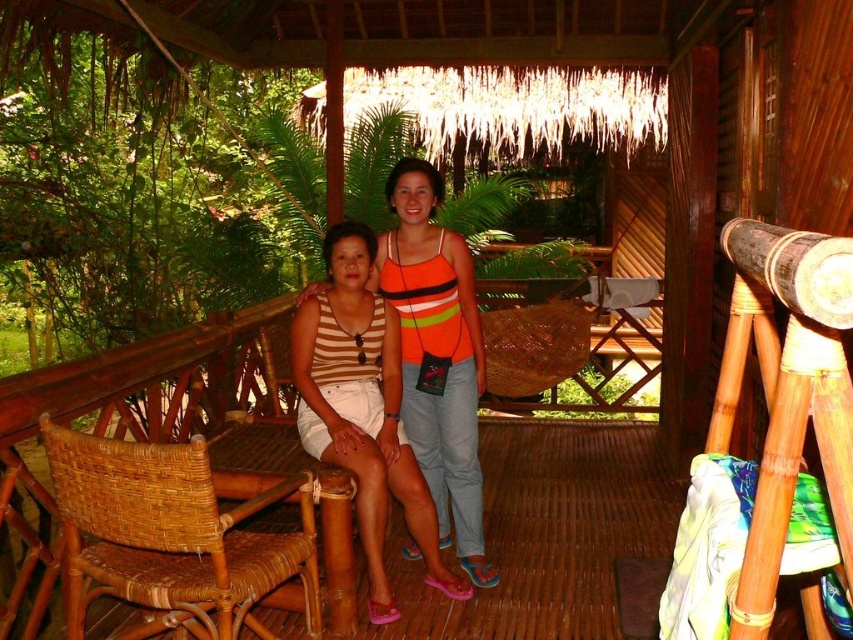
Locate an element on the screen. The height and width of the screenshot is (640, 853). woven rattan chair at lower left is located at coordinates (172, 536).

Between point (183, 504) and point (402, 413), which one is positioned behind?

Point (402, 413)

Identify the location of woven rattan chair at lower left. (172, 536).